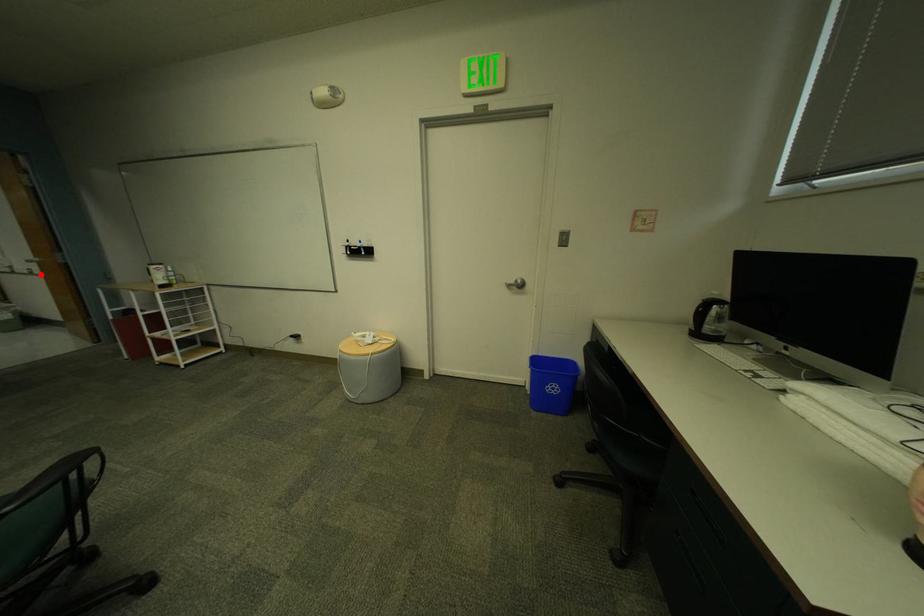
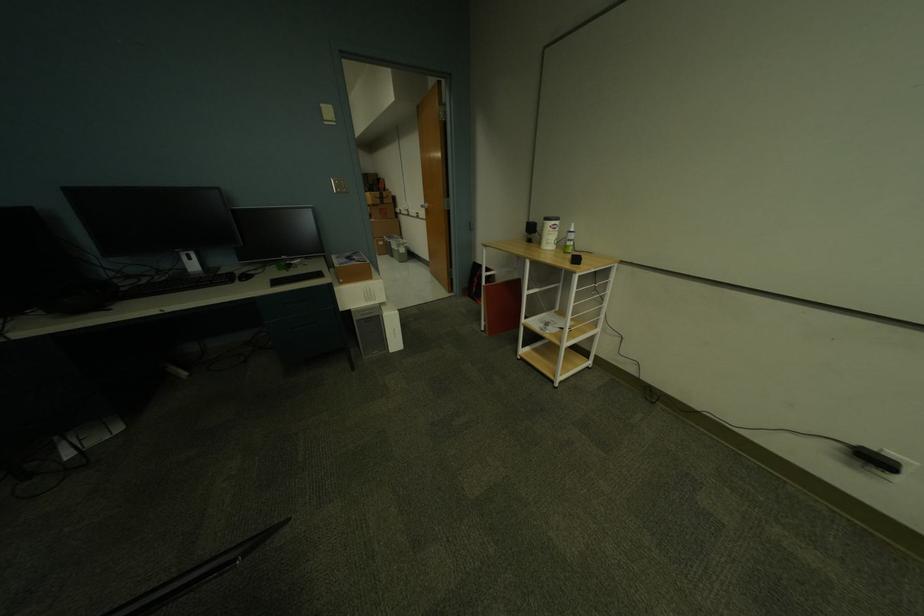
Question: A red point is marked in image1. In image2, is the corresponding 3D point closer to the camera or farther? Reply with the corresponding letter.

Choices:
 (A) The corresponding 3D point is closer.
 (B) The corresponding 3D point is farther.

Answer: (A)